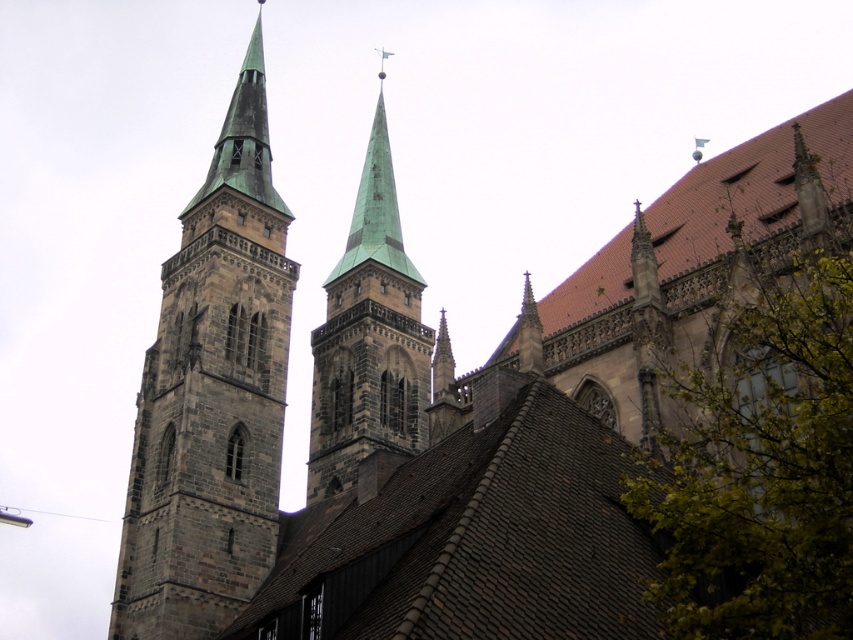
You are an architect assessing the church structure. You need to determine if the dark gray stone tower at left can support a new decorative element that requires the tower to be wider than the green copper steeple at center. Based on the image, is this possible?

The dark gray stone tower at left might be wider than green copper steeple at center, so it is possible that the tower can support the new decorative element if its width meets the requirement.

You are standing at the entrance of the historic church and want to locate the dark gray stone tower at left. Based on the coordinates provided, where should you look relative to your position?

The dark gray stone tower at left is located at coordinates point (212,396). This means it is positioned to the right and slightly below your current viewpoint.

You are standing in front of the historic church and want to take a photo. You notice two points marked on the image at coordinates point (x=788, y=390) and point (x=235, y=266). Which point is closer to your camera position?

Point (x=788, y=390) is closer to the camera than point (x=235, y=266).